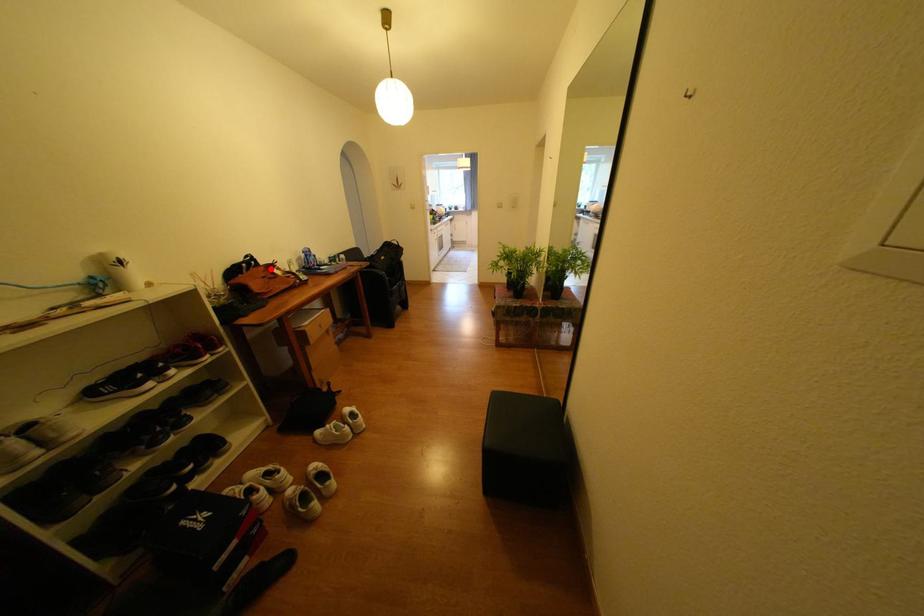
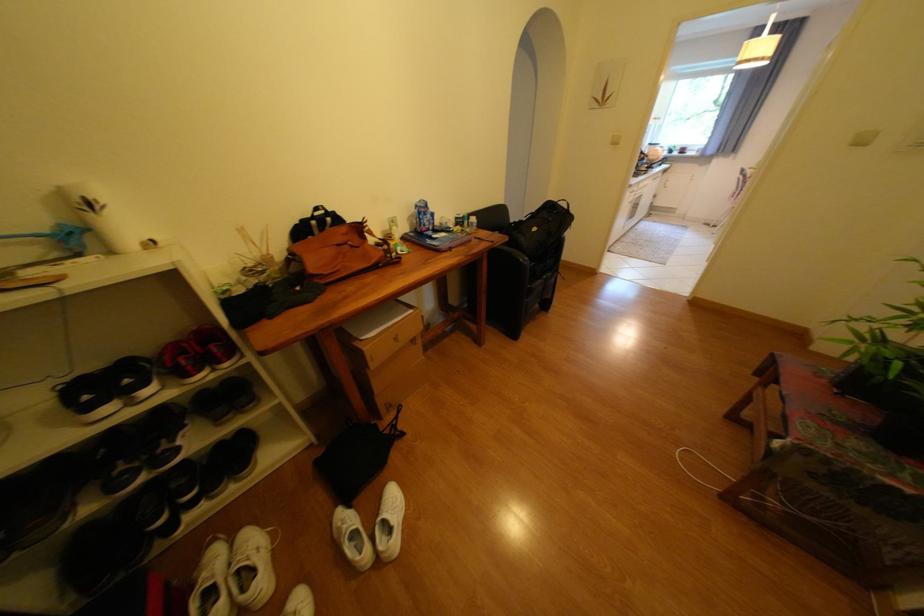
The point at the highlighted location is marked in the first image. Where is the corresponding point in the second image?

(351, 229)